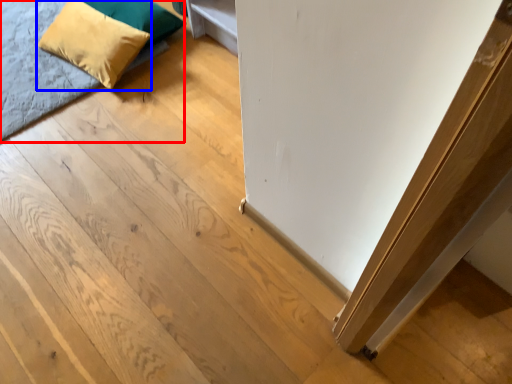
Question: Among these objects, which one is nearest to the camera, bed (highlighted by a red box) or pillow (highlighted by a blue box)?

Choices:
 (A) bed
 (B) pillow

Answer: (A)